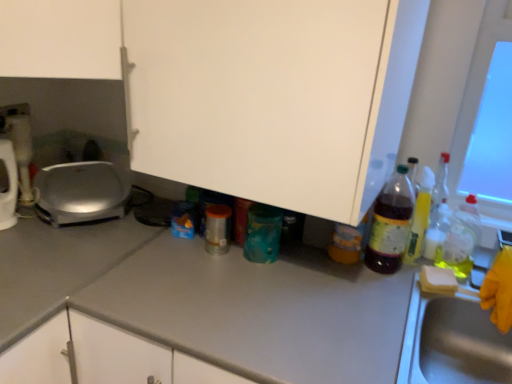
Image resolution: width=512 pixels, height=384 pixels. Find the location of `free space that is to the left of yellow sponge at right`. free space that is to the left of yellow sponge at right is located at coordinates (378, 288).